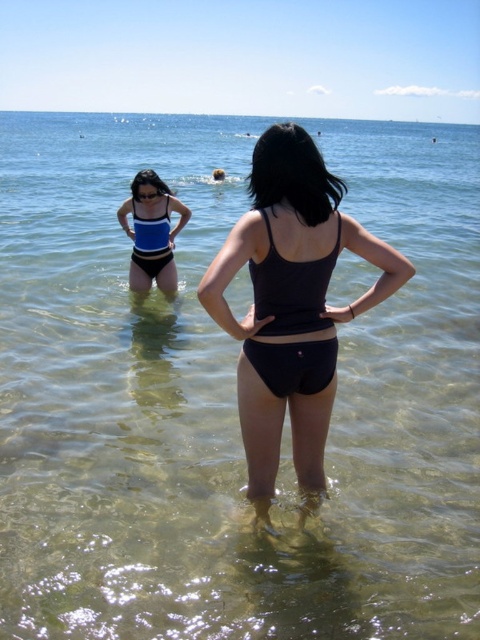
You are standing on the beach and see the black matte swimsuit at center in the water. If you want to reach it without getting your feet wet, what is the minimum distance you need to walk?

The black matte swimsuit at center is 2.74 meters away from viewer. To reach it without getting your feet wet, you need to walk at least 2.74 meters.

You are standing on the beach and want to take a photo of the black matte swimsuit at center. If your camera has a maximum focus range of 10 feet, will you be able to capture it clearly?

The black matte swimsuit at center is 8.99 feet away from the camera, which is within the maximum focus range of 10 feet. Therefore, the camera can focus on it clearly.

Based on the coordinates provided, which object is located at point (288, 308) in the beach scene?

The point (288, 308) indicates the black matte swimsuit at center.